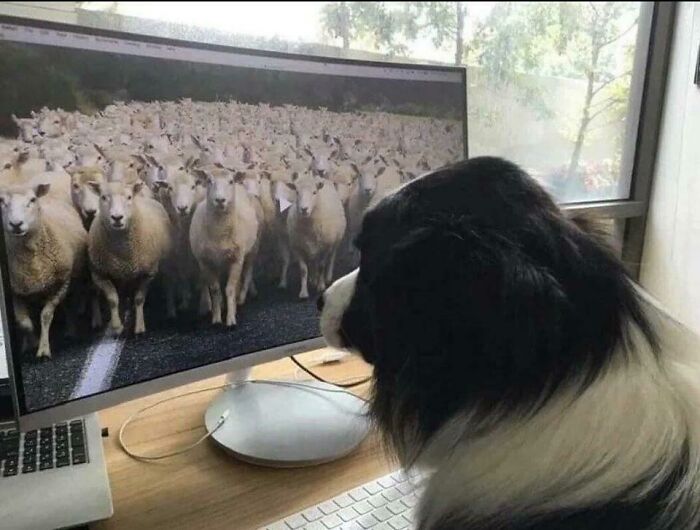
At what (x,y) coordinates should I click in order to perform the action: click on wooden desk. Please return your answer as a coordinate pair (x, y). The image size is (700, 530). Looking at the image, I should click on (176, 489).